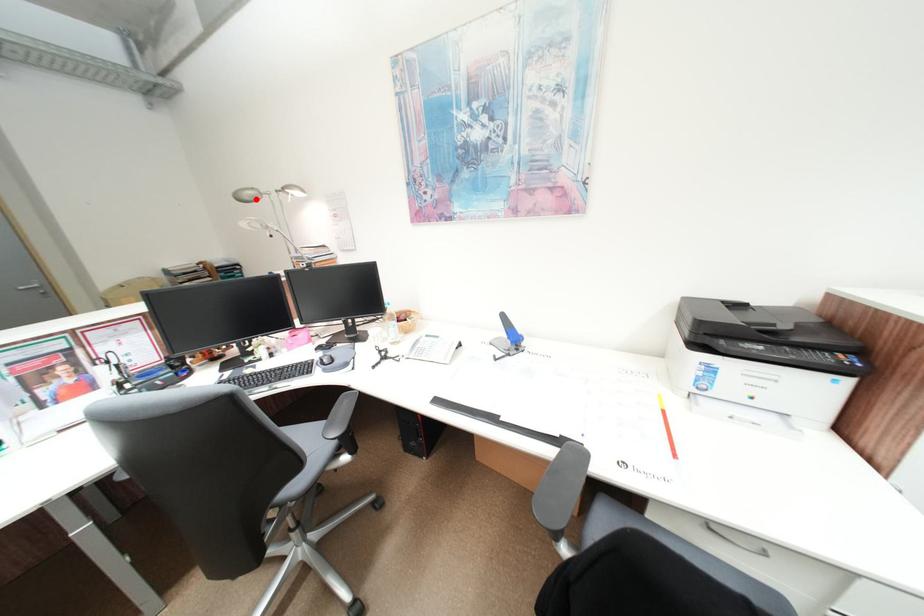
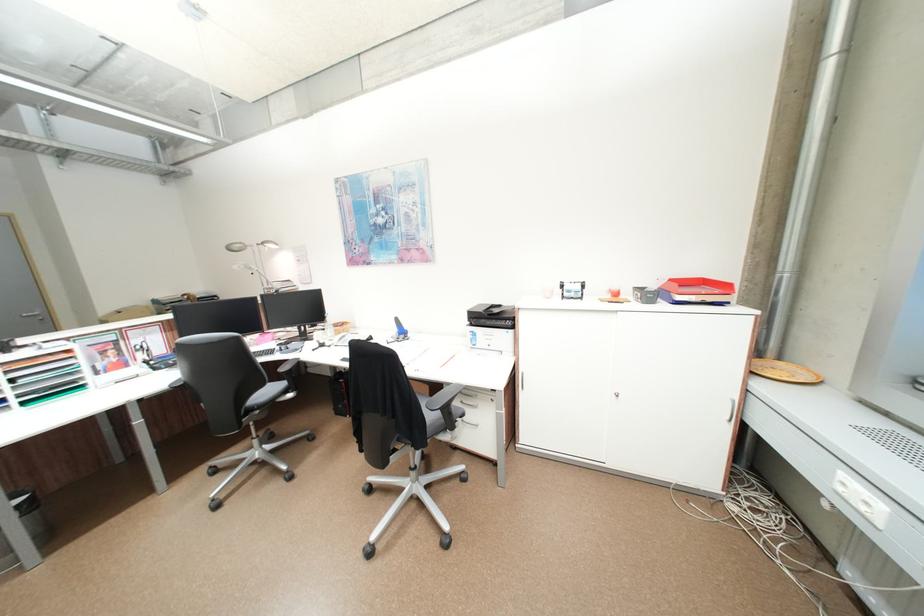
In the second image, find the point that corresponds to the highlighted location in the first image.

(245, 249)